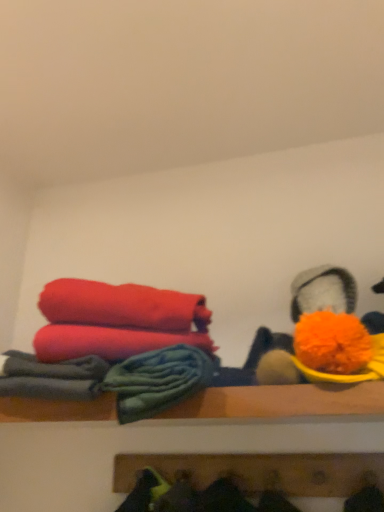
Question: Is point (306, 489) positioned closer to the camera than point (324, 393)?

Choices:
 (A) closer
 (B) farther

Answer: (B)

Question: From a real-world perspective, is wooden coat rack at lower center, placed as the 1th shelf when sorted from bottom to top, above or below wooden shelf at center, placed as the 2th shelf when sorted from bottom to top?

Choices:
 (A) above
 (B) below

Answer: (B)

Question: Estimate the real-world distances between objects in this image. Which object is closer to the matte red towel at left?

Choices:
 (A) wooden coat rack at lower center, which is counted as the 2th shelf, starting from the top
 (B) soft cotton towels at left
 (C) wooden shelf at center, the 1th shelf when ordered from top to bottom
 (D) fluffy orange pom-pom at upper right

Answer: (B)

Question: Which of these objects is positioned farthest from the fluffy orange pom-pom at upper right?

Choices:
 (A) matte red towel at left
 (B) soft cotton towels at left
 (C) wooden shelf at center, the 1th shelf when ordered from top to bottom
 (D) wooden coat rack at lower center, placed as the 1th shelf when sorted from bottom to top

Answer: (D)